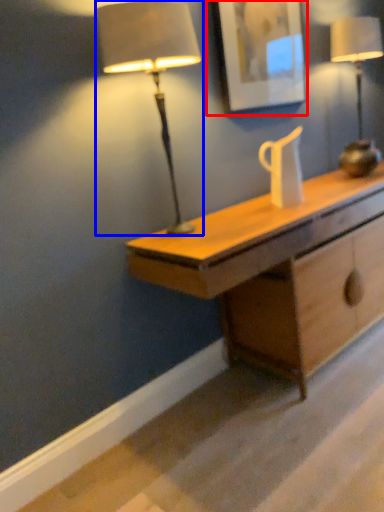
Question: Which object appears farthest to the camera in this image, picture frame (highlighted by a red box) or lamp (highlighted by a blue box)?

Choices:
 (A) picture frame
 (B) lamp

Answer: (A)